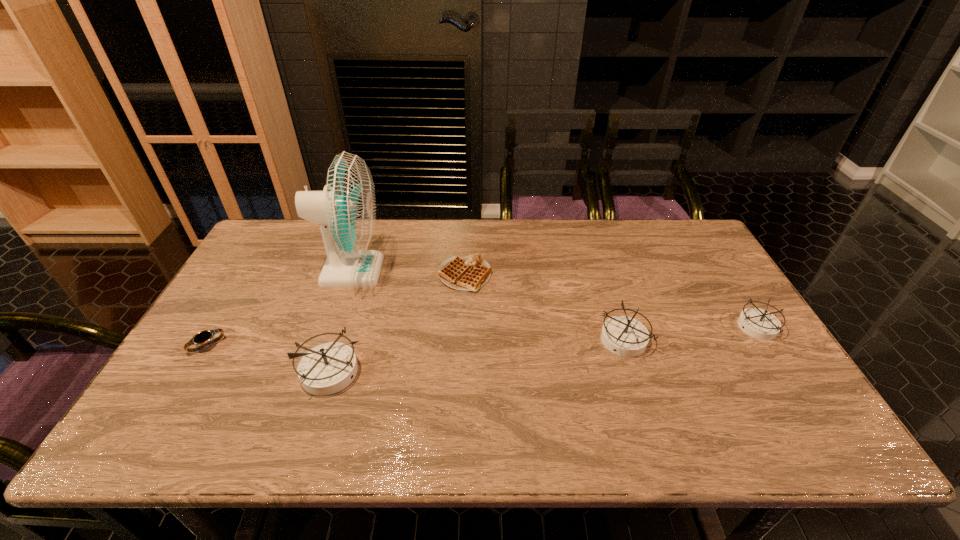
Locate an element on the screen. The image size is (960, 540). free space located on the left of the third shortest object is located at coordinates (603, 327).

Where is `blank space located 0.350m on the right of the leftmost object`? blank space located 0.350m on the right of the leftmost object is located at coordinates (355, 346).

In order to click on vacant area situated in front of the fan to face the airflow in this screenshot , I will do `click(461, 271)`.

I want to click on free region located on the left of the fourth object from left to right, so click(362, 275).

The height and width of the screenshot is (540, 960). In order to click on fan located at the far edge in this screenshot , I will do `click(345, 210)`.

This screenshot has width=960, height=540. I want to click on waffle that is at the far edge, so click(x=470, y=273).

Locate an element on the screen. Image resolution: width=960 pixels, height=540 pixels. object that is at the near edge is located at coordinates (327, 368).

Locate an element on the screen. object that is at the left edge is located at coordinates click(203, 337).

Locate an element on the screen. The image size is (960, 540). object at the right edge is located at coordinates (758, 323).

Locate an element on the screen. vacant space at the far edge of the desktop is located at coordinates (397, 258).